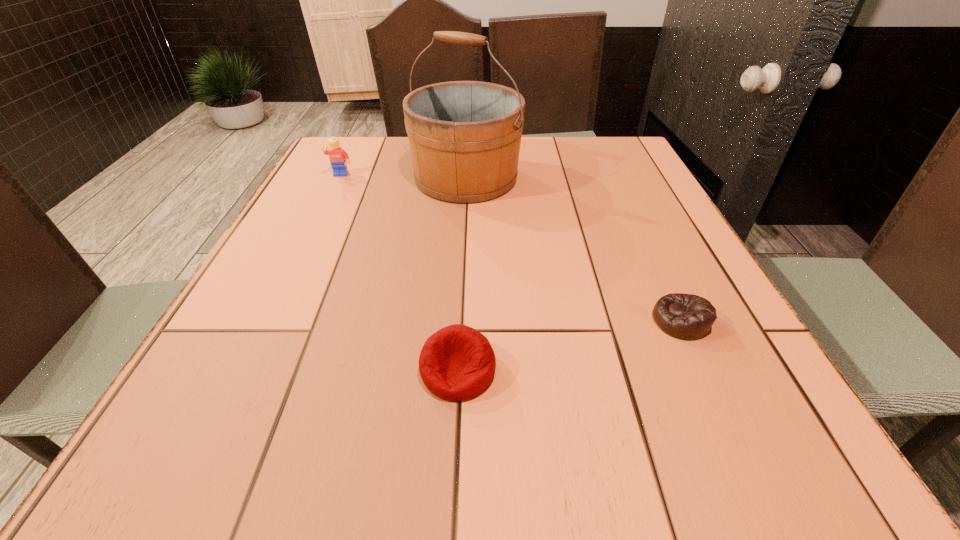
Identify the location of bucket. The width and height of the screenshot is (960, 540). (464, 136).

At what (x,y) coordinates should I click in order to perform the action: click on the second tallest object. Please return your answer as a coordinate pair (x, y). The height and width of the screenshot is (540, 960). Looking at the image, I should click on (338, 157).

Identify the location of Lego. This screenshot has height=540, width=960. (338, 157).

Where is `the left beanbag`? This screenshot has width=960, height=540. the left beanbag is located at coordinates (456, 363).

Locate an element on the screen. the taller beanbag is located at coordinates (456, 363).

The width and height of the screenshot is (960, 540). Find the location of `the shorter beanbag`. the shorter beanbag is located at coordinates (684, 316).

Find the location of a particular element. The height and width of the screenshot is (540, 960). the shortest object is located at coordinates (684, 316).

Image resolution: width=960 pixels, height=540 pixels. What are the coordinates of `vacant space located on the right of the bucket` in the screenshot? It's located at (612, 178).

Where is `free space located 0.310m on the face of the Lego`? free space located 0.310m on the face of the Lego is located at coordinates (304, 251).

The height and width of the screenshot is (540, 960). I want to click on free space located 0.070m on the seat area of the third tallest object, so click(454, 447).